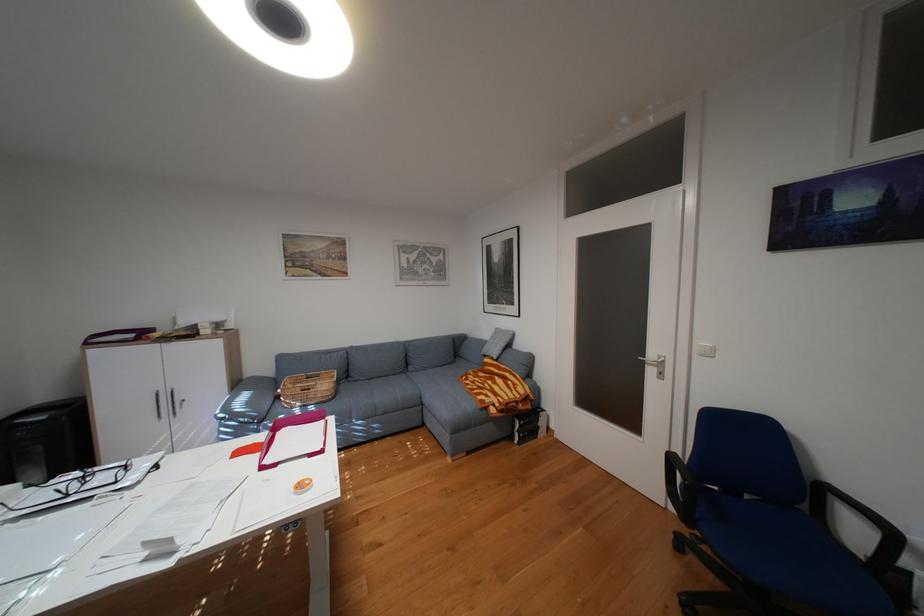
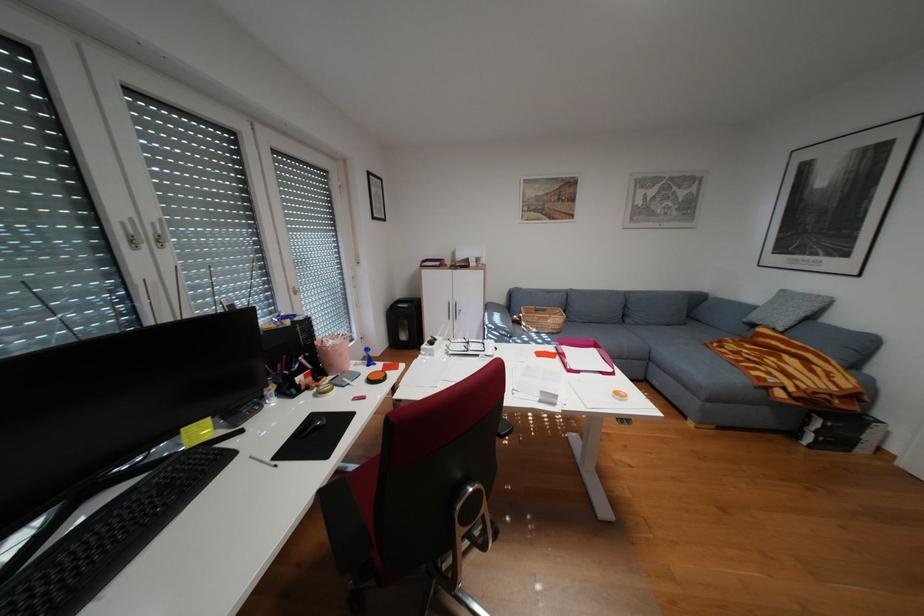
Find the pixel in the second image that matches point 167,334 in the first image.

(460, 262)